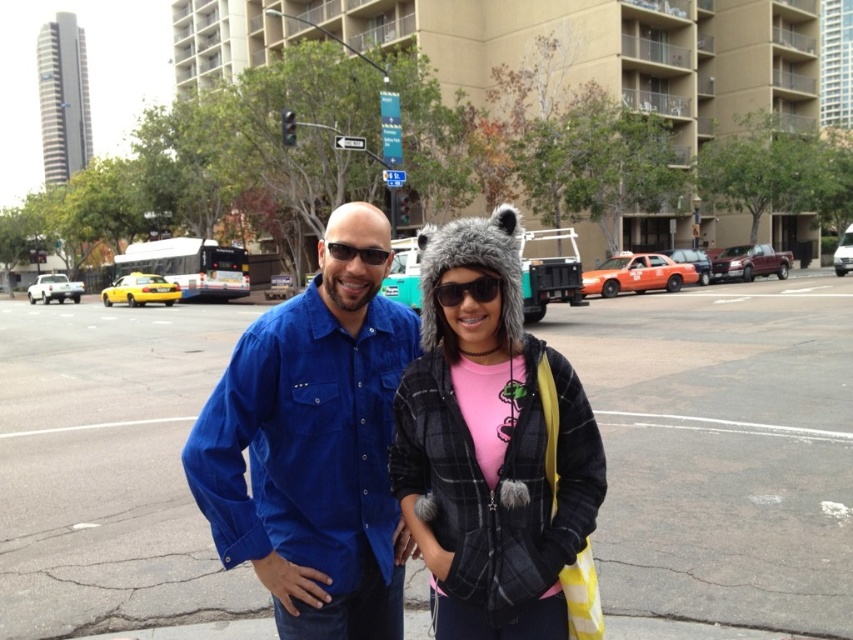
You are a photographer trying to capture a clear shot of both the plaid fleece jacket at center and the matte black sunglasses at center. Which object should you focus on first to ensure both are in focus?

The plaid fleece jacket at center is closer to the viewer than the matte black sunglasses at center. To ensure both are in focus, focus on the plaid fleece jacket at center first.

You are a photographer trying to capture both the blue corduroy shirt at center and the plaid fleece jacket at center in the same frame. Based on their positions, which one is closer to the camera?

The blue corduroy shirt at center is closer to the camera than the plaid fleece jacket at center because the plaid fleece jacket at center is positioned behind it.